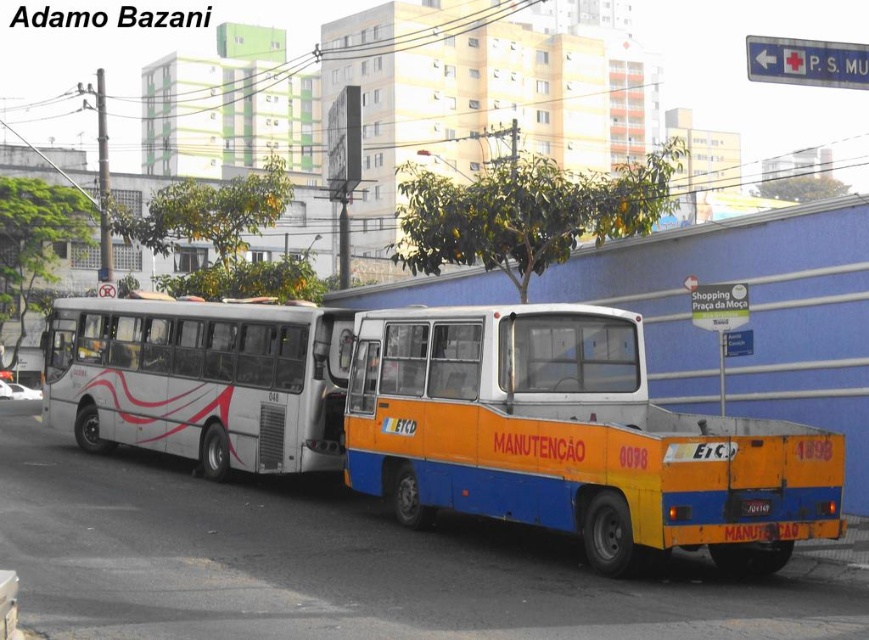
Between white glossy bus at center and black plastic license plate at center, which one has more height?

Standing taller between the two is white glossy bus at center.

Between white glossy bus at center and black plastic license plate at center, which one has less height?

black plastic license plate at center

Who is more forward, (190, 304) or (768, 508)?

Point (768, 508) is more forward.

At what (x,y) coordinates should I click in order to perform the action: click on white glossy bus at center. Please return your answer as a coordinate pair (x, y). The height and width of the screenshot is (640, 869). Looking at the image, I should click on (200, 380).

How distant is yellow matte bus at center from white glossy bus at center?

9.65 meters

Can you confirm if yellow matte bus at center is positioned to the left of white glossy bus at center?

No, yellow matte bus at center is not to the left of white glossy bus at center.

Is point (673, 476) in front of point (310, 339)?

Yes, it is in front of point (310, 339).

Image resolution: width=869 pixels, height=640 pixels. I want to click on yellow matte bus at center, so click(572, 438).

Where is `yellow matte bus at center`? Image resolution: width=869 pixels, height=640 pixels. yellow matte bus at center is located at coordinates (572, 438).

This screenshot has width=869, height=640. Identify the location of yellow matte bus at center. (572, 438).